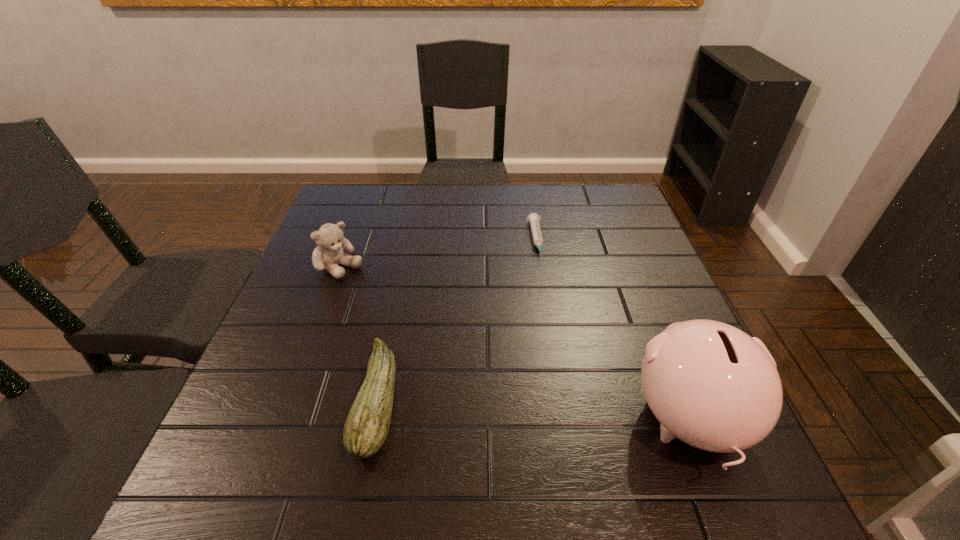
Where is `vacant point located between the piggy bank and the shortest object`? The image size is (960, 540). vacant point located between the piggy bank and the shortest object is located at coordinates (613, 332).

This screenshot has width=960, height=540. I want to click on free space between the syringe and the teddy bear, so click(438, 254).

This screenshot has width=960, height=540. In order to click on vacant space in between the tallest object and the leftmost object in this screenshot , I will do `click(515, 345)`.

Find the location of `free point between the second tallest object and the rightmost object`. free point between the second tallest object and the rightmost object is located at coordinates (515, 345).

Identify the location of free space between the second tallest object and the tallest object. This screenshot has width=960, height=540. (515, 345).

I want to click on free spot between the syringe and the zucchini, so (457, 320).

Where is `vacant area that lies between the leftmost object and the rightmost object`? This screenshot has width=960, height=540. vacant area that lies between the leftmost object and the rightmost object is located at coordinates (515, 345).

You are a GUI agent. You are given a task and a screenshot of the screen. Output one action in this format:
    pyautogui.click(x=<x>, y=<y>)
    Task: Click on the vacant space that's between the tallest object and the second shortest object
    This screenshot has width=960, height=540.
    Given the screenshot: What is the action you would take?
    pyautogui.click(x=535, y=410)

You are a GUI agent. You are given a task and a screenshot of the screen. Output one action in this format:
    pyautogui.click(x=<x>, y=<y>)
    Task: Click on the empty space between the third object from right to left and the syringe
    Image resolution: width=960 pixels, height=540 pixels.
    Given the screenshot: What is the action you would take?
    pyautogui.click(x=457, y=320)

Locate an element on the screen. free point between the leftmost object and the rightmost object is located at coordinates (515, 345).